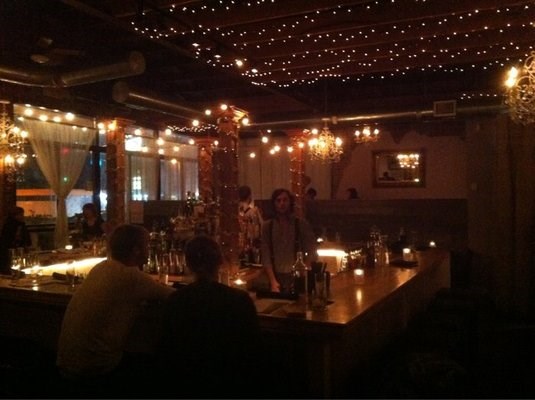
At what (x,y) coordinates should I click in order to perform the action: click on chandelier. Please return your answer as a coordinate pair (x, y). The width and height of the screenshot is (535, 400). Looking at the image, I should click on (326, 142), (371, 136), (12, 160).